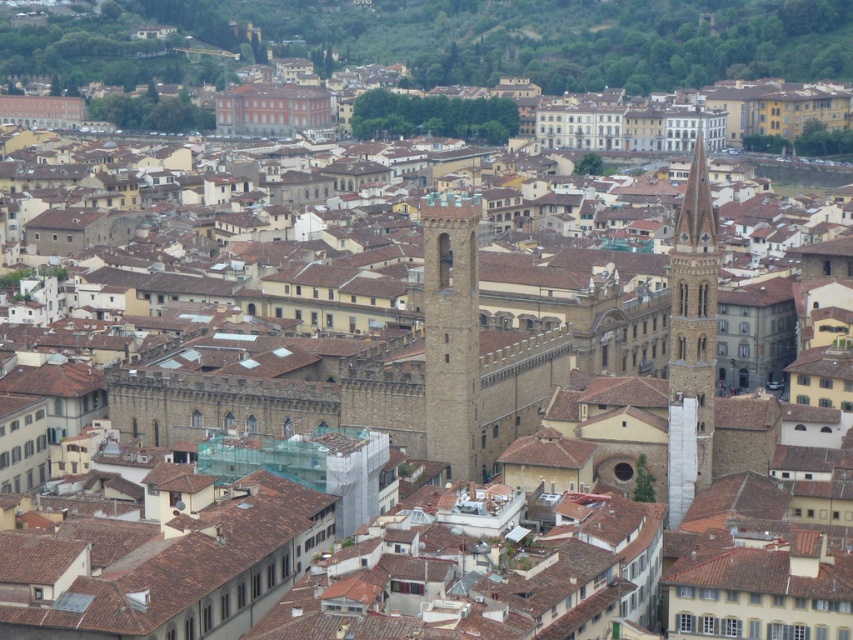
Question: Does brown stone tower at center come behind brown stone tower at center-right?

Choices:
 (A) yes
 (B) no

Answer: (A)

Question: Which of the following is the farthest from the observer?

Choices:
 (A) brown stone tower at center-right
 (B) brown stone tower at center

Answer: (B)

Question: Which point is closer to the camera?

Choices:
 (A) brown stone tower at center
 (B) brown stone tower at center-right

Answer: (B)

Question: Which of the following is the closest to the observer?

Choices:
 (A) brown stone tower at center-right
 (B) brown stone tower at center

Answer: (A)

Question: Where is brown stone tower at center located in relation to brown stone tower at center-right in the image?

Choices:
 (A) below
 (B) above

Answer: (A)

Question: Considering the relative positions of brown stone tower at center and brown stone tower at center-right in the image provided, where is brown stone tower at center located with respect to brown stone tower at center-right?

Choices:
 (A) right
 (B) left

Answer: (B)